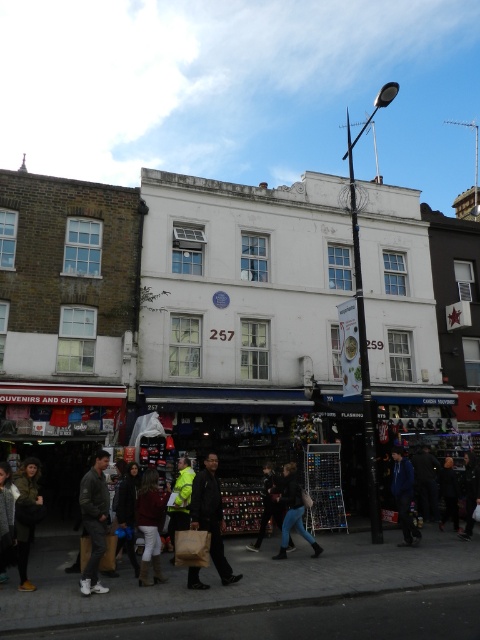
Who is higher up, green fuzzy jacket at lower left or dark blue jacket at center?

green fuzzy jacket at lower left is above.

Is green fuzzy jacket at lower left to the left of dark blue jacket at center from the viewer's perspective?

Yes, green fuzzy jacket at lower left is to the left of dark blue jacket at center.

Where is `green fuzzy jacket at lower left`? This screenshot has width=480, height=640. green fuzzy jacket at lower left is located at coordinates (26, 515).

The height and width of the screenshot is (640, 480). Identify the location of green fuzzy jacket at lower left. (26, 515).

Locate an element on the screen. dark brown leather jacket at center is located at coordinates (211, 515).

Does dark brown leather jacket at center have a greater width compared to green fuzzy jacket at lower left?

Indeed, dark brown leather jacket at center has a greater width compared to green fuzzy jacket at lower left.

Is point (212, 504) in front of point (27, 532)?

No, it is not.

Find the location of `dark brown leather jacket at center`. dark brown leather jacket at center is located at coordinates (211, 515).

Locate an element on the screen. dark blue jeans at center is located at coordinates (269, 502).

Is dark blue jeans at center wider than dark gray jacket at lower right?

No, dark blue jeans at center is not wider than dark gray jacket at lower right.

Identify the location of dark blue jeans at center. The image size is (480, 640). (269, 502).